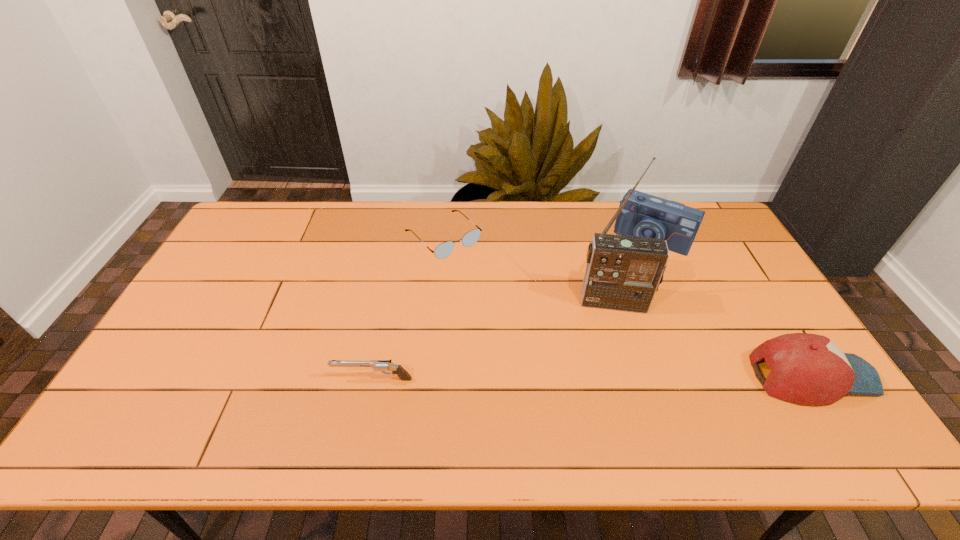
Locate an element on the screen. The image size is (960, 540). vacant space situated 0.060m on the lenses of the shortest object is located at coordinates point(475,268).

This screenshot has height=540, width=960. Identify the location of free point located on the lenses of the shortest object. (540, 328).

Identify the location of vacant space located 0.100m on the display of the tallest object. The width and height of the screenshot is (960, 540). (614, 341).

You are a GUI agent. You are given a task and a screenshot of the screen. Output one action in this format:
    pyautogui.click(x=<x>, y=<y>)
    Task: Click on the free space located 0.210m on the display of the tallest object
    Image resolution: width=960 pixels, height=540 pixels.
    Given the screenshot: What is the action you would take?
    (617, 375)

Image resolution: width=960 pixels, height=540 pixels. What are the coordinates of `blank area located 0.230m on the display of the tallest object` in the screenshot? It's located at (617, 382).

You are a GUI agent. You are given a task and a screenshot of the screen. Output one action in this format:
    pyautogui.click(x=<x>, y=<y>)
    Task: Click on the vacant area situated 0.220m on the lens of the fourth shortest object
    The width and height of the screenshot is (960, 540).
    Given the screenshot: What is the action you would take?
    pyautogui.click(x=615, y=294)

You are a GUI agent. You are given a task and a screenshot of the screen. Output one action in this format:
    pyautogui.click(x=<x>, y=<y>)
    Task: Click on the vacant space situated on the lens of the fourth shortest object
    The width and height of the screenshot is (960, 540).
    Given the screenshot: What is the action you would take?
    pyautogui.click(x=627, y=273)

Where is `free region located on the lens of the fourth shortest object`? The width and height of the screenshot is (960, 540). free region located on the lens of the fourth shortest object is located at coordinates (625, 277).

Identify the location of spectacles positioned at the far edge. (443, 250).

This screenshot has height=540, width=960. I want to click on camera positioned at the far edge, so click(644, 215).